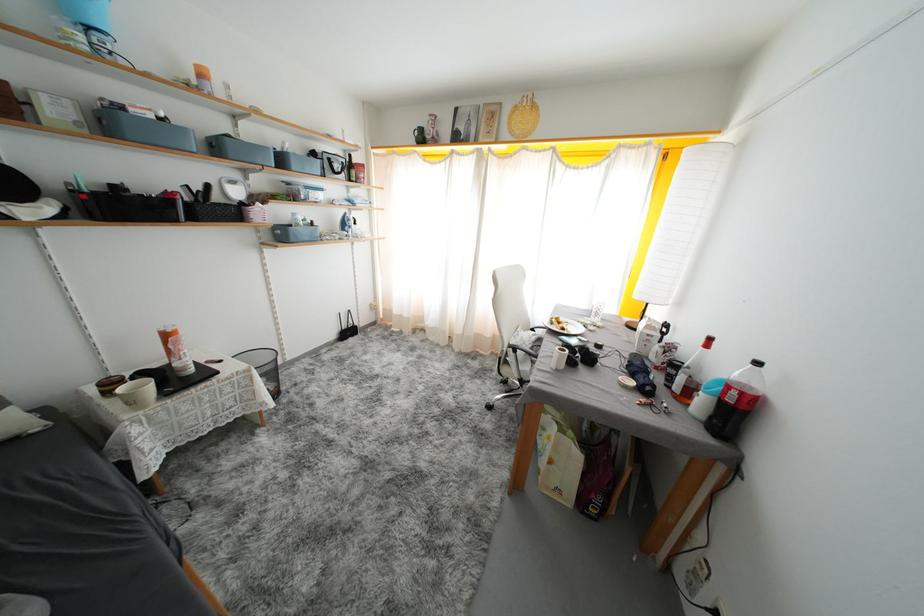
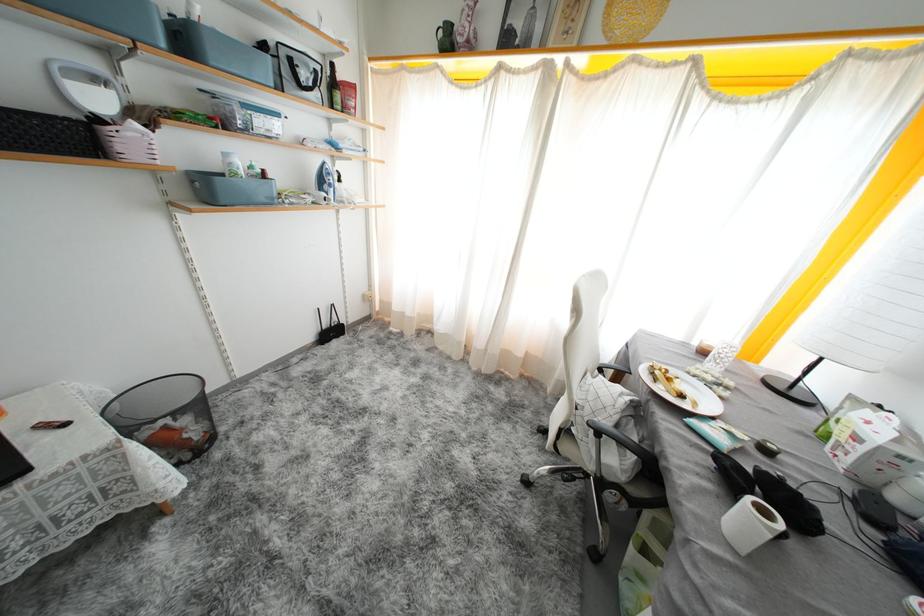
Locate, in the second image, the point that corresponds to pixel 569 333 in the first image.

(687, 400)